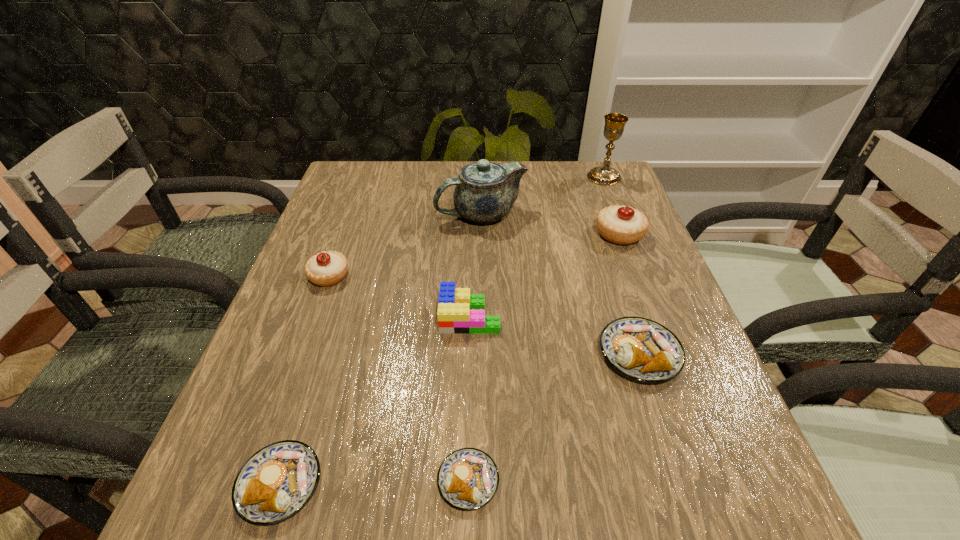
Locate an element on the screen. This screenshot has height=540, width=960. blank area in the image that satisfies the following two spatial constraints: 1. from the spout of the seventh shortest object; 2. on the front side of the shortest object is located at coordinates (482, 481).

Identify the location of free space that satisfies the following two spatial constraints: 1. on the back side of the chalice; 2. on the right side of the third shortest pastry. (582, 177).

Locate an element on the screen. This screenshot has width=960, height=540. free spot that satisfies the following two spatial constraints: 1. on the front side of the fifth nearest object; 2. on the left side of the second smallest brown pastry is located at coordinates (252, 484).